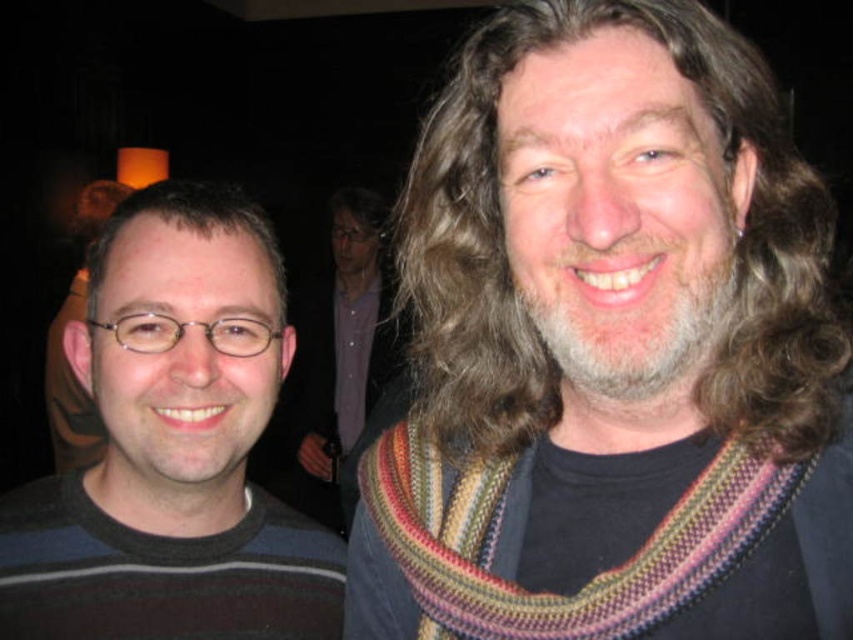
Is knitted multicolored scarf at right closer to camera compared to knitted scarf at center?

Yes.

Who is more forward, (711, 524) or (349, 506)?

Point (711, 524) is in front.

At what (x,y) coordinates should I click in order to perform the action: click on knitted multicolored scarf at right. Please return your answer as a coordinate pair (x, y). The height and width of the screenshot is (640, 853). Looking at the image, I should click on (590, 541).

Between brown wavy hair at right and knitted scarf at center, which one is positioned higher?

brown wavy hair at right is higher up.

The image size is (853, 640). I want to click on brown wavy hair at right, so click(x=508, y=266).

Between knitted multicolored scarf at right and dark brown hair at left, which one is positioned lower?

knitted multicolored scarf at right is below.

Is point (496, 600) closer to viewer compared to point (160, 214)?

Yes, it is.

At what (x,y) coordinates should I click in order to perform the action: click on knitted multicolored scarf at right. Please return your answer as a coordinate pair (x, y). This screenshot has height=640, width=853. Looking at the image, I should click on (590, 541).